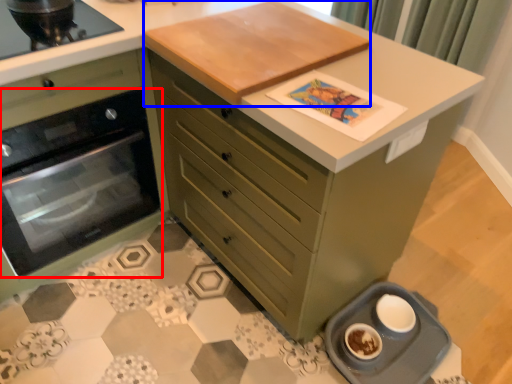
Question: Which of the following is the closest to the observer, kitchen appliance (highlighted by a red box) or table top (highlighted by a blue box)?

Choices:
 (A) kitchen appliance
 (B) table top

Answer: (B)